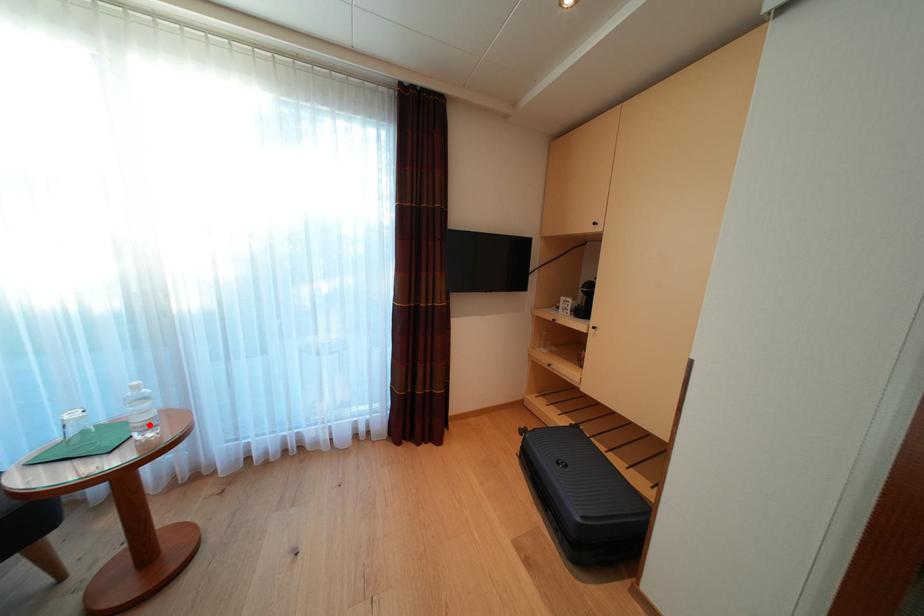
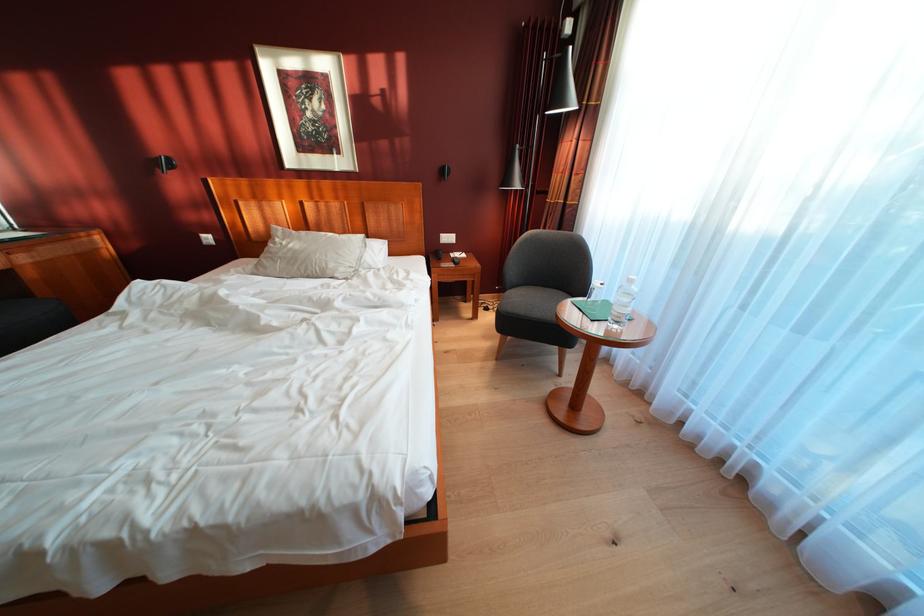
Question: I am providing you with two images of the same scene from different viewpoints. Given a red point in image1, look at the same physical point in image2. Is it:

Choices:
 (A) Closer to the viewpoint
 (B) Farther from the viewpoint

Answer: (A)